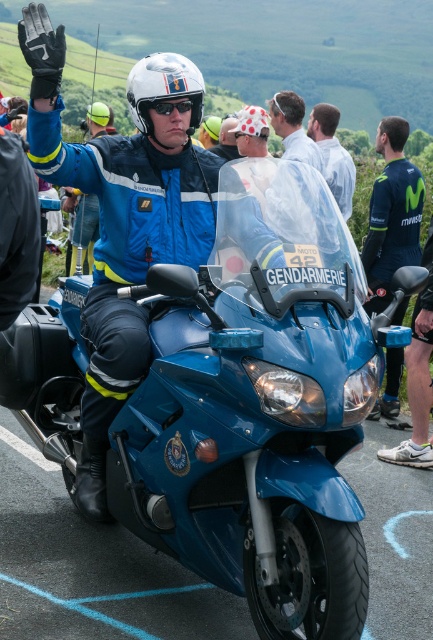
You are a photographer standing at the roadside. You want to take a photo of the blue glossy motorcycle at center and the white matte helmet at center so that both are clearly visible. Which object should you focus on first if you want to ensure the motorcycle is in focus?

The blue glossy motorcycle at center has a greater height compared to the white matte helmet at center, so you should focus on the blue glossy motorcycle at center first to ensure it is in focus.

You are a photographer standing in front of the scene. You notice the matte blue motorcycle at center and the blue jersey at center. Which object is positioned lower in the image?

The matte blue motorcycle at center is positioned below the blue jersey at center, so it is lower in the image.

You are a photographer standing at the camera position. You want to take a photo of the blue glossy motorcycle at center. The motorcycle requires a minimum distance of 10 feet to ensure clarity. Can you take a clear photo from your current position?

The blue glossy motorcycle at center is 9.46 feet away from the camera, which is less than the required 10 feet. Therefore, you cannot take a clear photo from your current position.